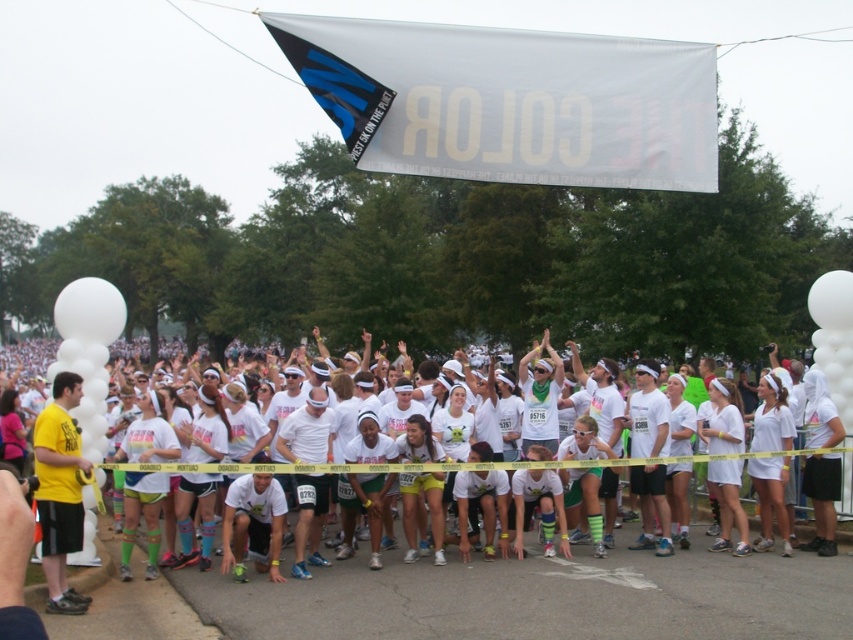
Is yellow matte shirt at left shorter than white matte shorts at lower right?

Incorrect, yellow matte shirt at left's height does not fall short of white matte shorts at lower right's.

Is yellow matte shirt at left positioned before white matte shorts at lower right?

Yes, it is.

In order to click on yellow matte shirt at left in this screenshot , I will do [x=61, y=490].

Locate an element on the screen. The image size is (853, 640). yellow matte shirt at left is located at coordinates (61, 490).

Is white matte t-shirt at center smaller than white matte shorts at lower right?

No, white matte t-shirt at center is not smaller than white matte shorts at lower right.

Does point (514, 582) come in front of point (728, 524)?

That is True.

Where is `white matte t-shirt at center`? Image resolution: width=853 pixels, height=640 pixels. white matte t-shirt at center is located at coordinates (538, 596).

You are a GUI agent. You are given a task and a screenshot of the screen. Output one action in this format:
    pyautogui.click(x=<x>, y=<y>)
    Task: Click on the white fabric banner at upper center
    
    Given the screenshot: What is the action you would take?
    pyautogui.click(x=509, y=102)

Consider the image. Does white fabric banner at upper center have a greater height compared to white matte shorts at lower right?

No, white fabric banner at upper center is not taller than white matte shorts at lower right.

Which is in front, point (592, 67) or point (712, 412)?

Point (712, 412)

Locate an element on the screen. Image resolution: width=853 pixels, height=640 pixels. white fabric banner at upper center is located at coordinates (509, 102).